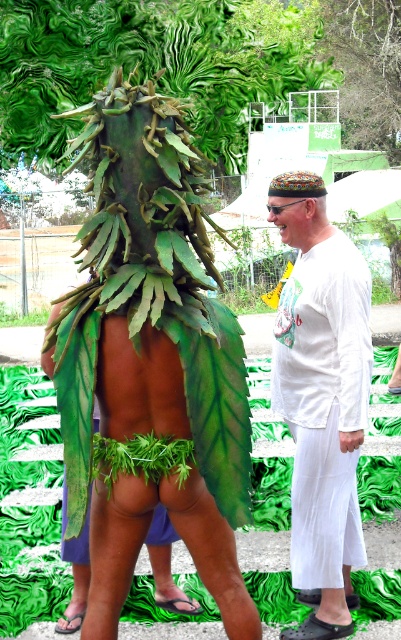
You are standing in the crowd watching the festival parade and see both the white satin shirt at center and the green leafy costume at center. Which one appears nearer to you?

The white satin shirt at center is closer to the viewer than the green leafy costume at center, so the white satin shirt at center appears nearer.

You are a photographer at the event and want to ensure both the white satin shirt at center and the green leafy costume at center are visible in your photo. Which object should you focus on to include both in the frame?

The white satin shirt at center is taller than the green leafy costume at center, so focusing on the white satin shirt at center will help ensure both are visible in the frame.

You are a photographer at the festival trying to capture both the multicolored woven hat at center and the green leafy costume at center in a single wide shot. Given that your camera has a maximum focal length of 20 feet, will you be able to include both objects in the frame?

The multicolored woven hat at center and green leafy costume at center are 42.10 feet apart from each other. Since the distance between them exceeds the camera maximum focal length of 20 feet, you won